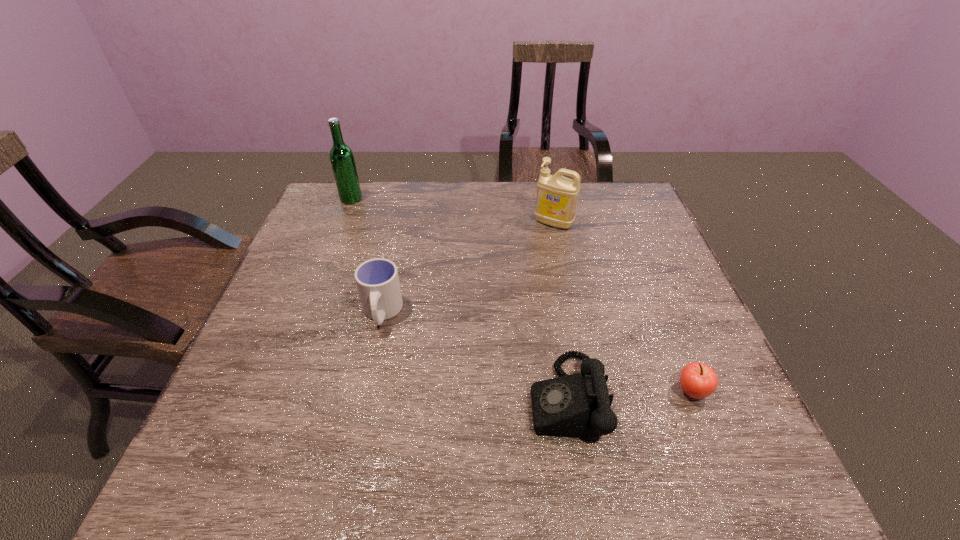
Identify the location of beer bottle. The image size is (960, 540). (342, 160).

At what (x,y) coordinates should I click in order to perform the action: click on the farthest object. Please return your answer as a coordinate pair (x, y). Looking at the image, I should click on (342, 160).

I want to click on the second farthest object, so click(x=556, y=201).

In order to click on detergent in this screenshot , I will do `click(556, 201)`.

Where is `the third nearest object`? the third nearest object is located at coordinates (377, 280).

Locate an element on the screen. cup is located at coordinates (377, 280).

Find the location of a particular element. Image resolution: width=960 pixels, height=540 pixels. telephone is located at coordinates (579, 405).

The height and width of the screenshot is (540, 960). I want to click on the rightmost object, so click(x=698, y=380).

Find the location of a particular element. apple is located at coordinates (698, 380).

The image size is (960, 540). I want to click on free point located 0.050m on the back of the leftmost object, so click(x=356, y=185).